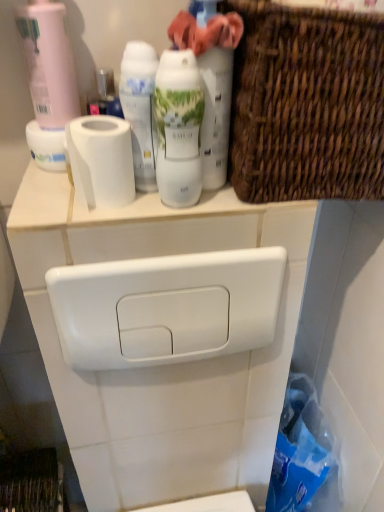
Find the location of a particular element. Image resolution: width=384 pixels, height=512 pixels. vacant position to the left of white matte toilet paper at upper left is located at coordinates pos(44,202).